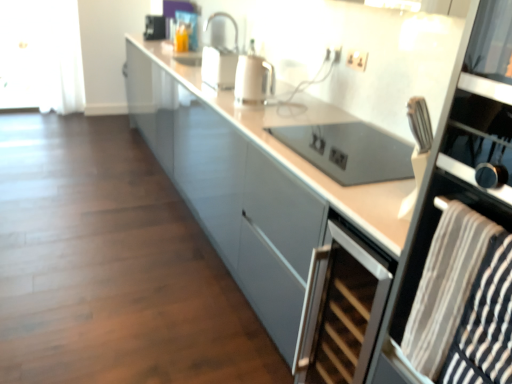
What do you see at coordinates (458, 166) in the screenshot?
I see `black glass oven at right` at bounding box center [458, 166].

Describe the element at coordinates (343, 310) in the screenshot. The image size is (512, 384). I see `silver metallic wine cooler at lower right` at that location.

How much space does white plastic electric outlet at upper center, positioned as the first electric outlet in left-to-right order, occupy vertically?

white plastic electric outlet at upper center, positioned as the first electric outlet in left-to-right order, is 9.72 centimeters tall.

Locate an element on the screen. Image resolution: width=512 pixels, height=384 pixels. white glossy cabinet at center is located at coordinates (249, 185).

Image resolution: width=512 pixels, height=384 pixels. I want to click on satin silver oven at center, acting as the first appliance starting from the bottom, so click(349, 151).

Locate an element on the screen. This screenshot has width=512, height=384. white glossy kettle at center is located at coordinates (253, 79).

Where is `matte white electric outlet at upper right, placed as the first electric outlet when sorted from front to back`? This screenshot has height=384, width=512. matte white electric outlet at upper right, placed as the first electric outlet when sorted from front to back is located at coordinates (357, 60).

Does white glossy kettle at center have a smaller size compared to silver metallic wine cooler at lower right?

Yes.

Is white glossy kettle at center positioned beyond the bounds of silver metallic wine cooler at lower right?

Absolutely, white glossy kettle at center is external to silver metallic wine cooler at lower right.

How far apart are white glossy kettle at center and silver metallic wine cooler at lower right?

They are 3.66 feet apart.

Which is in front, white sheer curtain at left or silver metallic wine cooler at lower right?

silver metallic wine cooler at lower right is closer to the camera.

Considering the relative sizes of white sheer curtain at left and silver metallic wine cooler at lower right in the image provided, is white sheer curtain at left taller than silver metallic wine cooler at lower right?

Yes.

Would you consider white sheer curtain at left to be distant from silver metallic wine cooler at lower right?

white sheer curtain at left is far away from silver metallic wine cooler at lower right.

You are a GUI agent. You are given a task and a screenshot of the screen. Output one action in this format:
    pyautogui.click(x=<x>, y=<y>)
    Task: Click on the 1st electric outlet directly above the black glass oven at right (from a real-world perspective)
    This screenshot has width=512, height=384.
    Given the screenshot: What is the action you would take?
    [333, 55]

How many degrees apart are the facing directions of black glass oven at right and white plastic electric outlet at upper center, which is counted as the second electric outlet, starting from the right?

They differ by 0.167 degrees in their facing directions.

From a real-world perspective, which is physically below, black glass oven at right or white plastic electric outlet at upper center, marked as the first electric outlet in a back-to-front arrangement?

From a 3D spatial view, black glass oven at right is below.

Can you confirm if black glass oven at right is taller than white plastic electric outlet at upper center, which is counted as the second electric outlet, starting from the right?

Correct, black glass oven at right is much taller as white plastic electric outlet at upper center, which is counted as the second electric outlet, starting from the right.

What's the angular difference between striped fabric towel at right and satin silver oven at center, the second appliance when ordered from top to bottom,'s facing directions?

They differ by 0.052 degrees in their facing directions.

Does striped fabric towel at right turn towards satin silver oven at center, the first appliance viewed from the right?

No, striped fabric towel at right is not turned towards satin silver oven at center, the first appliance viewed from the right.

From the image's perspective, is striped fabric towel at right below satin silver oven at center, the second appliance when ordered from top to bottom?

Indeed, from the image's perspective, striped fabric towel at right is shown beneath satin silver oven at center, the second appliance when ordered from top to bottom.

From the image's perspective, which object appears higher, satin silver oven at center, the first appliance viewed from the right, or striped fabric towel at right?

satin silver oven at center, the first appliance viewed from the right, is shown above in the image.

Consider the image. From their relative heights in the image, would you say satin silver oven at center, the 2th appliance positioned from the back, is taller or shorter than striped fabric towel at right?

Considering their sizes, satin silver oven at center, the 2th appliance positioned from the back, has less height than striped fabric towel at right.

Is satin silver oven at center, which ranks as the 1th appliance in front-to-back order, at the left side of striped fabric towel at right?

No, satin silver oven at center, which ranks as the 1th appliance in front-to-back order, is not to the left of striped fabric towel at right.

Is there a large distance between satin silver oven at center, the 2th appliance positioned from the back, and striped fabric towel at right?

No, satin silver oven at center, the 2th appliance positioned from the back, is not far from striped fabric towel at right.

The image size is (512, 384). Identify the location of oven lying on the right of matte white electric outlet at upper right, which ranks as the second electric outlet in left-to-right order. (458, 166).

What's the angular difference between black glass oven at right and matte white electric outlet at upper right, which ranks as the second electric outlet in left-to-right order,'s facing directions?

The facing directions of black glass oven at right and matte white electric outlet at upper right, which ranks as the second electric outlet in left-to-right order, are 0.743 degrees apart.

Between black glass oven at right and matte white electric outlet at upper right, which ranks as the second electric outlet in left-to-right order, which one appears on the right side from the viewer's perspective?

black glass oven at right.

From the image's perspective, who appears lower, black glass oven at right or matte white electric outlet at upper right, placed as the first electric outlet when sorted from front to back?

black glass oven at right.

Is satin silver oven at center, acting as the first appliance starting from the bottom, next to metallic silver toaster at upper center, which is the 2th appliance from front to back, and touching it?

No, satin silver oven at center, acting as the first appliance starting from the bottom, is not with metallic silver toaster at upper center, which is the 2th appliance from front to back.

Who is taller, satin silver oven at center, the second appliance when ordered from top to bottom, or metallic silver toaster at upper center, which is the 2th appliance from front to back?

With more height is metallic silver toaster at upper center, which is the 2th appliance from front to back.

In the scene shown: Between satin silver oven at center, the 2th appliance when ordered from left to right, and metallic silver toaster at upper center, marked as the 1th appliance in a back-to-front arrangement, which one has larger width?

Wider between the two is satin silver oven at center, the 2th appliance when ordered from left to right.

Is metallic silver toaster at upper center, marked as the 1th appliance in a back-to-front arrangement, located within satin silver oven at center, acting as the first appliance starting from the bottom?

No, metallic silver toaster at upper center, marked as the 1th appliance in a back-to-front arrangement, is not a part of satin silver oven at center, acting as the first appliance starting from the bottom.

Find the location of a particular element. Image resolution: width=512 pixels, height=384 pixels. kitchen appliance behind the silver metallic wine cooler at lower right is located at coordinates (253, 79).

Locate an element on the screen. The height and width of the screenshot is (384, 512). glass door lying on the left of silver metallic wine cooler at lower right is located at coordinates pos(41,56).

From the image, which object appears to be farther from satin silver oven at center, the 2th appliance positioned from the back, silver metallic wine cooler at lower right or white plastic electric outlet at upper center, which is counted as the second electric outlet, starting from the right?

The object further to satin silver oven at center, the 2th appliance positioned from the back, is white plastic electric outlet at upper center, which is counted as the second electric outlet, starting from the right.

Which object lies nearer to the anchor point metallic silver toaster at upper center, the first appliance in the left-to-right sequence, striped fabric towel at right or white glossy kettle at center?

Based on the image, white glossy kettle at center appears to be nearer to metallic silver toaster at upper center, the first appliance in the left-to-right sequence.

Considering their positions, is white plastic electric outlet at upper center, marked as the first electric outlet in a back-to-front arrangement, positioned further to white glossy cabinet at center than matte white electric outlet at upper right, which is the first electric outlet from right to left?

Among the two, white plastic electric outlet at upper center, marked as the first electric outlet in a back-to-front arrangement, is located further to white glossy cabinet at center.

Considering their positions, is white sheer curtain at left positioned closer to white glossy cabinet at center than satin silver oven at center, the first appliance viewed from the right?

Based on the image, satin silver oven at center, the first appliance viewed from the right, appears to be nearer to white glossy cabinet at center.

Estimate the real-world distances between objects in this image. Which object is further from white plastic electric outlet at upper center, positioned as the first electric outlet in left-to-right order, black glass oven at right or white sheer curtain at left?

white sheer curtain at left is further to white plastic electric outlet at upper center, positioned as the first electric outlet in left-to-right order.

From the image, which object appears to be farther from white glossy cabinet at center, black glass oven at right or silver metallic wine cooler at lower right?

black glass oven at right is further to white glossy cabinet at center.

Which object lies nearer to the anchor point white sheer curtain at left, white plastic electric outlet at upper center, the second electric outlet from the front, or white glossy cabinet at center?

white glossy cabinet at center.

In the scene shown: When comparing their distances from metallic silver toaster at upper center, the first appliance in the left-to-right sequence, does black glass oven at right or white sheer curtain at left seem closer?

white sheer curtain at left.

This screenshot has width=512, height=384. I want to click on home appliance between striped fabric towel at right and white sheer curtain at left from front to back, so click(x=343, y=310).

Locate an element on the screen. home appliance positioned between striped fabric towel at right and matte white electric outlet at upper right, which is the 2th electric outlet in back-to-front order, from near to far is located at coordinates (343, 310).

You are a GUI agent. You are given a task and a screenshot of the screen. Output one action in this format:
    pyautogui.click(x=<x>, y=<y>)
    Task: Click on the appliance between black glass oven at right and metallic silver toaster at upper center, marked as the 1th appliance in a back-to-front arrangement, from front to back
    This screenshot has height=384, width=512.
    Given the screenshot: What is the action you would take?
    pyautogui.click(x=349, y=151)

Locate an element on the screen. appliance between white glossy cabinet at center and silver metallic wine cooler at lower right vertically is located at coordinates (349, 151).